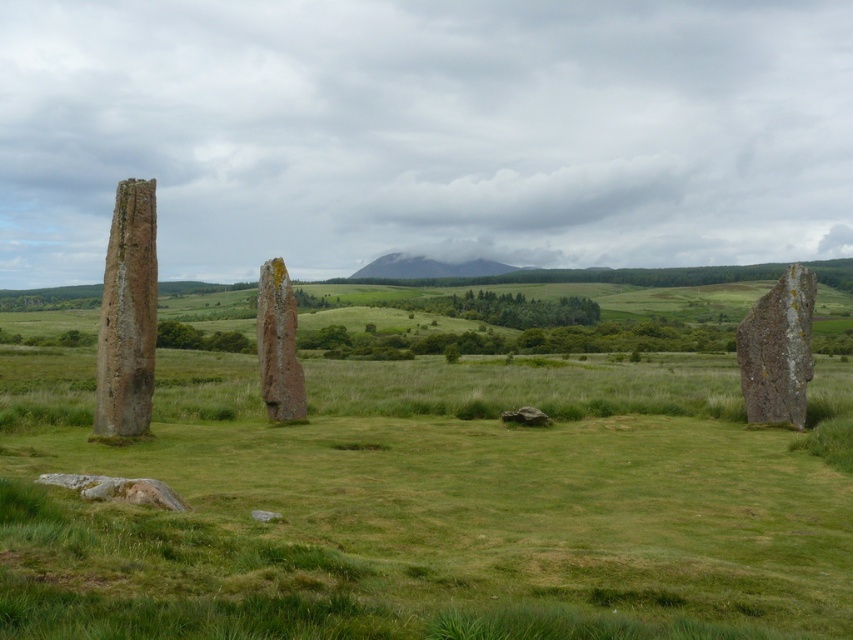
You are a visitor standing in front of the rustic stone pillar at left and the smooth gray stone at right. Which stone can you see in more detail?

The rustic stone pillar at left is closer to the viewer than the smooth gray stone at right, so you can see the rustic stone pillar at left in more detail.

You are standing at the center of the field and want to move towards the rustic stone pillar at left. Which direction should you face to walk straight towards it?

You should face towards the left direction to walk straight towards the rustic stone pillar at left since it is located at point 0.495 on the x axis which is to the left of the center point 0.5.

Based on the photo, you are a photographer planning to capture the rustic stone pillar at left and the smooth gray stone at right in a single frame. Based on their positions, which stone should you focus on first if you want to include both in your shot from left to right?

The rustic stone pillar at left should be focused on first since it is positioned on the left side of the smooth gray stone at right, aligning with a left to right composition.